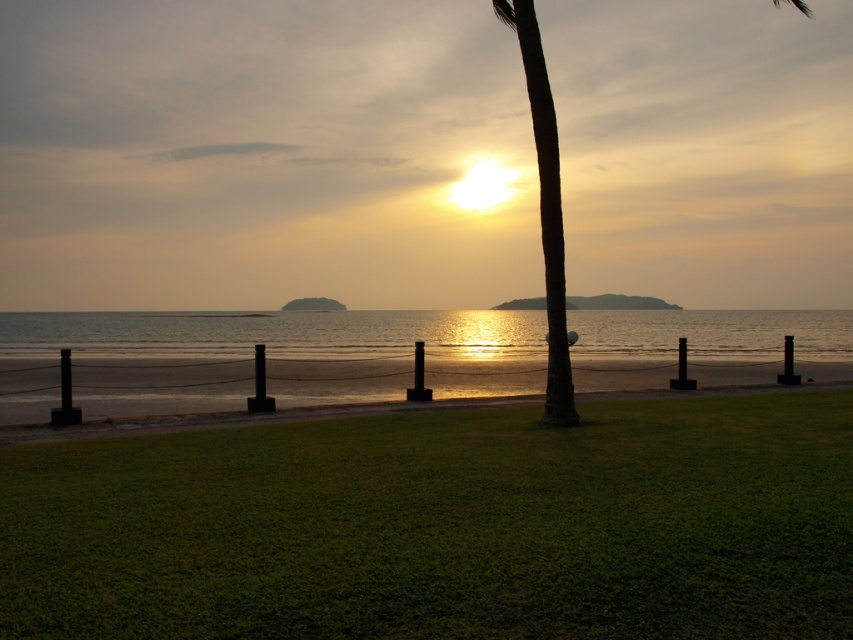
Which is behind, point (846, 445) or point (537, 163)?

The point (537, 163) is more distant.

This screenshot has width=853, height=640. Describe the element at coordinates (444, 525) in the screenshot. I see `green grass at center` at that location.

Find the location of a particular element. This screenshot has height=640, width=853. green grass at center is located at coordinates point(444,525).

Does green grass at center appear on the left side of glistening water at center?

Indeed, green grass at center is positioned on the left side of glistening water at center.

Can you confirm if green grass at center is thinner than glistening water at center?

A: Correct, green grass at center's width is less than glistening water at center's.

The height and width of the screenshot is (640, 853). I want to click on green grass at center, so click(444, 525).

Is glistening water at center to the left of green leafy palm tree at center from the viewer's perspective?

In fact, glistening water at center is to the right of green leafy palm tree at center.

Describe the element at coordinates (265, 358) in the screenshot. The height and width of the screenshot is (640, 853). I see `glistening water at center` at that location.

This screenshot has width=853, height=640. What do you see at coordinates (265, 358) in the screenshot?
I see `glistening water at center` at bounding box center [265, 358].

The image size is (853, 640). In order to click on glistening water at center in this screenshot , I will do `click(265, 358)`.